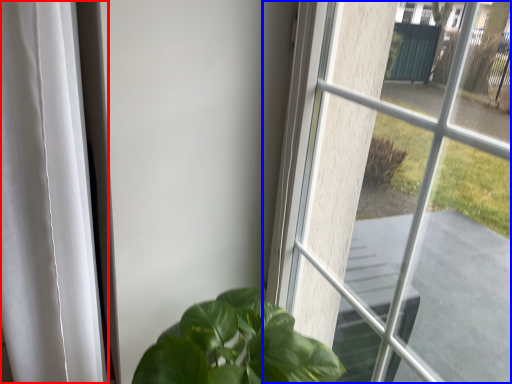
Question: Which of the following is the closest to the observer, curtain (highlighted by a red box) or window (highlighted by a blue box)?

Choices:
 (A) curtain
 (B) window

Answer: (B)